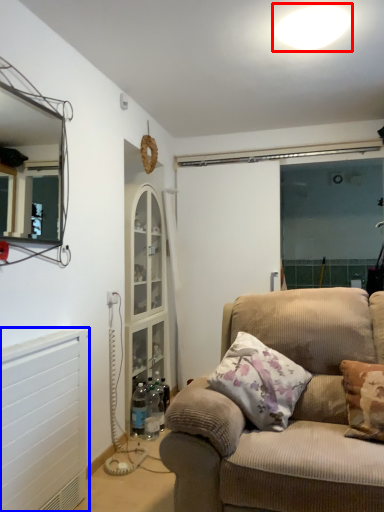
Question: Among these objects, which one is nearest to the camera, light (highlighted by a red box) or radiator (highlighted by a blue box)?

Choices:
 (A) light
 (B) radiator

Answer: (B)